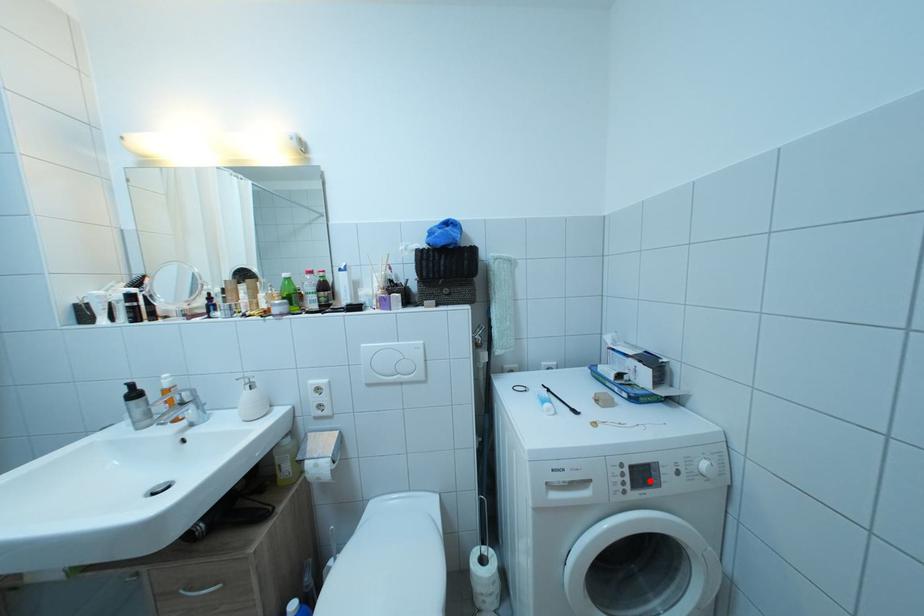
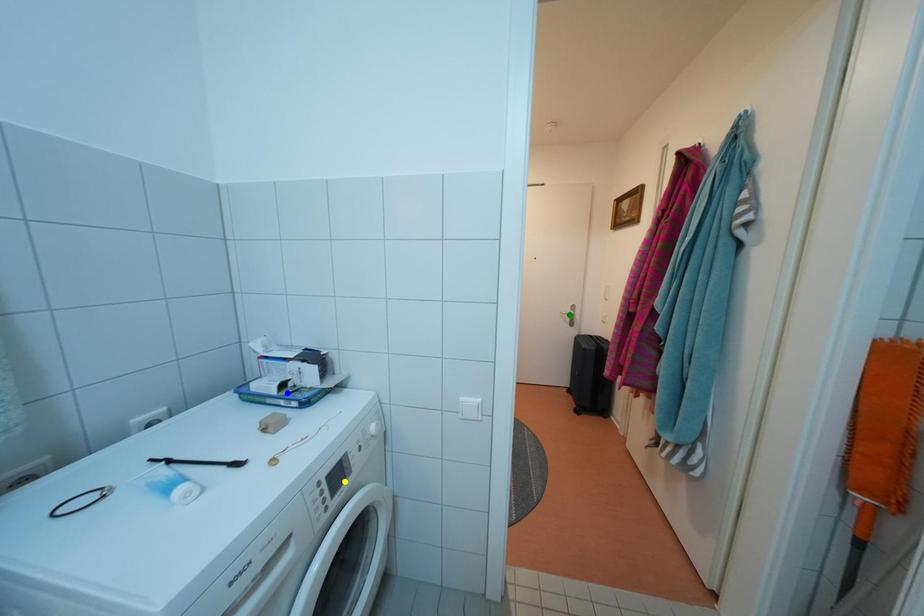
Question: I am providing you with two images of the same scene from different viewpoints. A red point is marked on the first image. You are given multiple points on the second image. Which point in image 2 represents the same 3d spot as the red point in image 1?

Choices:
 (A) blue point
 (B) yellow point
 (C) green point

Answer: (B)